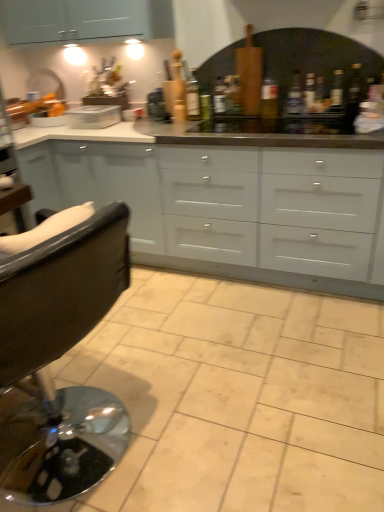
Find the location of `free location in front of green glass bottle at center, the 1th bottle viewed from the left`. free location in front of green glass bottle at center, the 1th bottle viewed from the left is located at coordinates (193, 125).